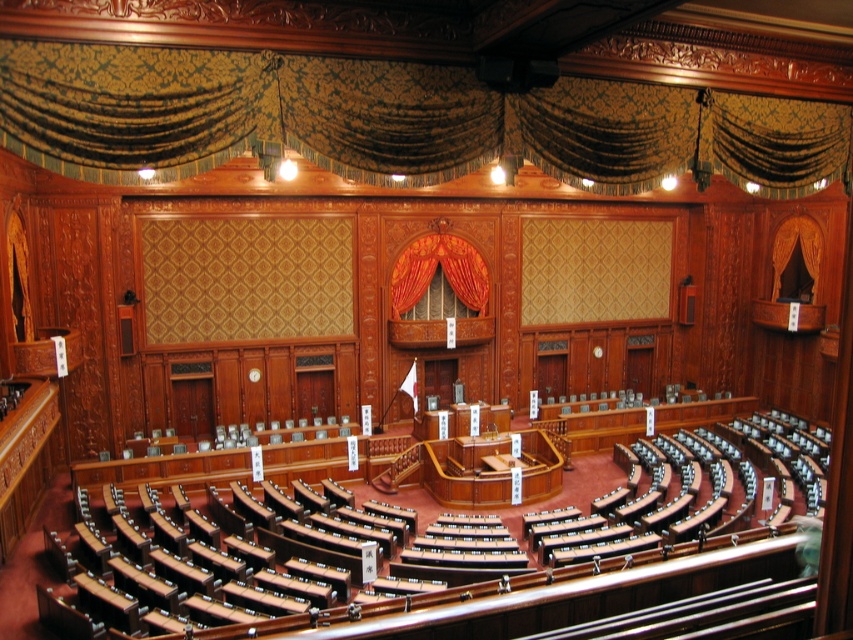
You are attending a formal event in this assembly hall and need to locate the speaker podium. You notice two curtains nearby. Which curtain is closer to the speaker podium? The gold damask curtain at upper center or the velvet orange curtain at center?

The velvet orange curtain at center is closer to the speaker podium because the gold damask curtain at upper center is to the right of it, meaning the velvet orange curtain at center is positioned between the speaker podium and the gold damask curtain.

You are standing in the assembly hall and want to hang a decorative banner between the gold damask curtain at upper center and the velvet orange curtain at center. Which curtain is nearer to you to attach the banner?

The gold damask curtain at upper center is closer to the viewer than the velvet orange curtain at center, so you should attach the banner to the gold damask curtain at upper center first as it is nearer.

You are standing in the assembly hall and want to determine the relative positions of two points marked in the image. Which point is closer to you, point (102, 113) or point (409, 305)?

Point (102, 113) is closer to the viewer than point (409, 305).